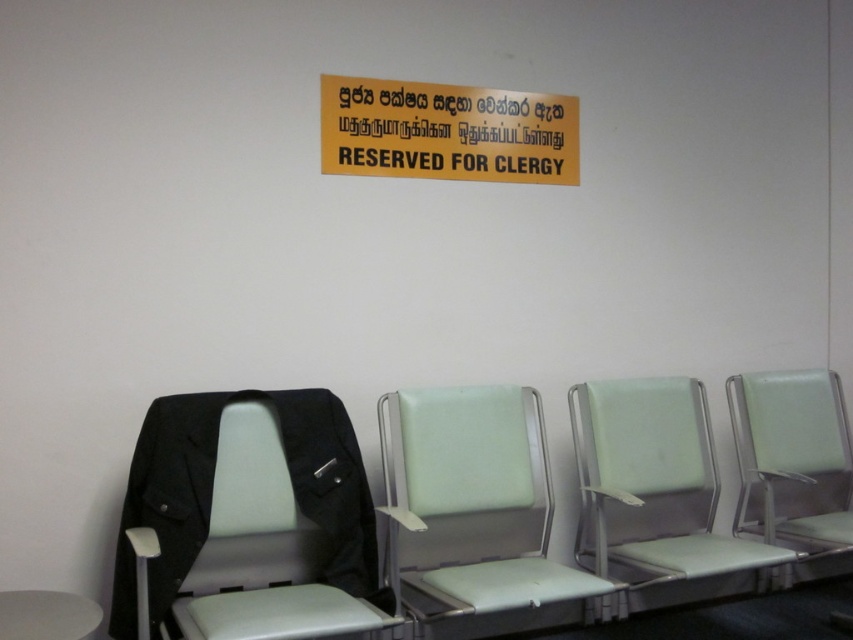
What is the position of the light green fabric chair at center relative to the yellow matte signboard at upper center?

The light green fabric chair at center is to the right of the yellow matte signboard at upper center.

Which object corresponds to the coordinates point (653, 483)?

The light green plastic chair at center corresponds to the coordinates point (653, 483).